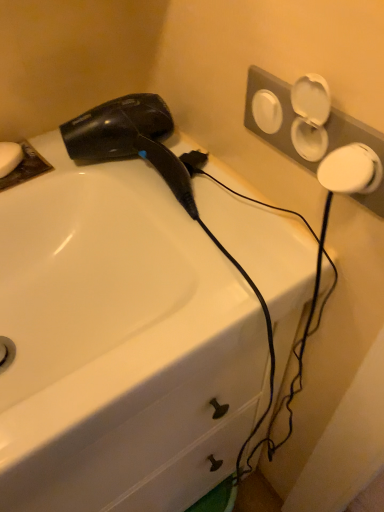
Identify the location of white matte soap at upper left. The image size is (384, 512). point(9,157).

Describe the element at coordinates (130, 139) in the screenshot. I see `black glossy hair dryer at upper left` at that location.

Where is `white glossy sink at upper left`? This screenshot has height=512, width=384. white glossy sink at upper left is located at coordinates (136, 320).

Is point (164, 374) closer to camera compared to point (14, 153)?

Yes.

Is white glossy sink at upper left looking in the opposite direction of white matte soap at upper left?

No, white glossy sink at upper left is not facing away from white matte soap at upper left.

Which object is more forward, white glossy sink at upper left or white matte soap at upper left?

Positioned in front is white glossy sink at upper left.

Is white glossy sink at upper left thinner than white matte soap at upper left?

No.

From the image's perspective, is white matte soap at upper left under white glossy sink at upper left?

Incorrect, from the image's perspective, white matte soap at upper left is higher than white glossy sink at upper left.

Considering the points (13, 142) and (74, 301), which point is behind, point (13, 142) or point (74, 301)?

The point (13, 142) is more distant.

Between white matte soap at upper left and white glossy sink at upper left, which one has smaller size?

Smaller between the two is white matte soap at upper left.

Can we say black glossy hair dryer at upper left lies outside white glossy sink at upper left?

Yes.

Relative to white glossy sink at upper left, is black glossy hair dryer at upper left in front or behind?

In the image, black glossy hair dryer at upper left appears behind white glossy sink at upper left.

How far apart are black glossy hair dryer at upper left and white glossy sink at upper left?

black glossy hair dryer at upper left and white glossy sink at upper left are 6.61 inches apart from each other.

From the picture: Could you tell me if black glossy hair dryer at upper left is facing white glossy sink at upper left?

No, black glossy hair dryer at upper left is not turned towards white glossy sink at upper left.

Are black glossy hair dryer at upper left and white matte soap at upper left located far from each other?

Actually, black glossy hair dryer at upper left and white matte soap at upper left are a little close together.

Choose the correct answer: Is black glossy hair dryer at upper left inside white matte soap at upper left or outside it?

black glossy hair dryer at upper left lies outside white matte soap at upper left.

Considering the relative sizes of black glossy hair dryer at upper left and white matte soap at upper left in the image provided, is black glossy hair dryer at upper left smaller than white matte soap at upper left?

Actually, black glossy hair dryer at upper left might be larger than white matte soap at upper left.

Considering their positions, is white matte soap at upper left located in front of or behind black glossy hair dryer at upper left?

white matte soap at upper left is positioned farther from the viewer than black glossy hair dryer at upper left.

Who is taller, white matte soap at upper left or black glossy hair dryer at upper left?

Standing taller between the two is black glossy hair dryer at upper left.

What's the angular difference between white matte soap at upper left and black glossy hair dryer at upper left's facing directions?

They differ by 15.5 degrees in their facing directions.

Does white glossy sink at upper left have a larger size compared to black glossy hair dryer at upper left?

Yes.

Between white glossy sink at upper left and black glossy hair dryer at upper left, which one has smaller width?

With smaller width is black glossy hair dryer at upper left.

Looking at this image, is white glossy sink at upper left turned away from black glossy hair dryer at upper left?

No, white glossy sink at upper left is not facing away from black glossy hair dryer at upper left.

I want to click on sink located underneath the white matte soap at upper left (from a real-world perspective), so click(136, 320).

This screenshot has height=512, width=384. Identify the location of sink on the right side of white matte soap at upper left. (136, 320).

When comparing their distances from white matte soap at upper left, does black glossy hair dryer at upper left or white glossy sink at upper left seem closer?

Among the two, black glossy hair dryer at upper left is located nearer to white matte soap at upper left.

Considering their positions, is white glossy sink at upper left positioned closer to white matte soap at upper left than black glossy hair dryer at upper left?

black glossy hair dryer at upper left lies closer to white matte soap at upper left than the other object.

Based on their spatial positions, is black glossy hair dryer at upper left or white matte soap at upper left further from white glossy sink at upper left?

white matte soap at upper left is positioned further to the anchor white glossy sink at upper left.

Estimate the real-world distances between objects in this image. Which object is further from black glossy hair dryer at upper left, white glossy sink at upper left or white matte soap at upper left?

white matte soap at upper left lies further to black glossy hair dryer at upper left than the other object.

Estimate the real-world distances between objects in this image. Which object is closer to black glossy hair dryer at upper left, white matte soap at upper left or white glossy sink at upper left?

white glossy sink at upper left lies closer to black glossy hair dryer at upper left than the other object.

From the image, which object appears to be farther from white glossy sink at upper left, white matte soap at upper left or black glossy hair dryer at upper left?

white matte soap at upper left.

Identify the location of hair drier between white matte soap at upper left and white glossy sink at upper left in the up-down direction. Image resolution: width=384 pixels, height=512 pixels. (130, 139).